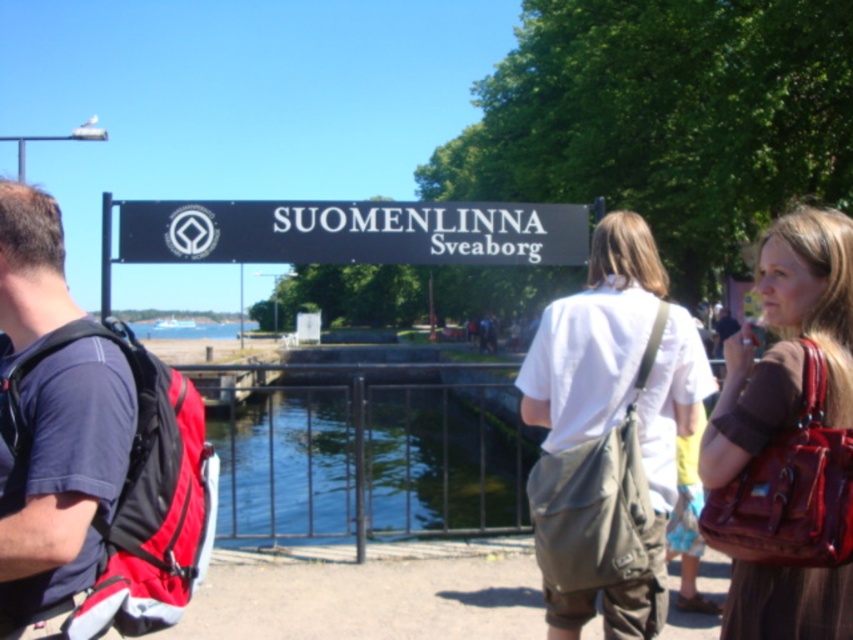
Between point (730, 468) and point (225, 220), which one is positioned behind?

Positioned behind is point (225, 220).

From the picture: Who is positioned more to the right, brown shiny handbag at center right or black plastic sign at center?

brown shiny handbag at center right

Which is behind, point (782, 582) or point (279, 236)?

Point (279, 236)

Image resolution: width=853 pixels, height=640 pixels. In order to click on brown shiny handbag at center right in this screenshot , I will do `click(787, 440)`.

What do you see at coordinates (367, 449) in the screenshot? I see `clear glass water at center` at bounding box center [367, 449].

Does clear glass water at center appear under white cotton shirt at center?

Indeed, clear glass water at center is positioned under white cotton shirt at center.

Describe the element at coordinates (367, 449) in the screenshot. The width and height of the screenshot is (853, 640). I see `clear glass water at center` at that location.

At what (x,y) coordinates should I click in order to perform the action: click on clear glass water at center. Please return your answer as a coordinate pair (x, y). This screenshot has width=853, height=640. Looking at the image, I should click on (367, 449).

Who is more forward, (238, 387) or (115, 422)?

Point (115, 422) is more forward.

Who is shorter, clear glass water at center or dark blue fabric shirt at left?

With less height is dark blue fabric shirt at left.

Who is more distant from viewer, [212,436] or [103,365]?

The point [212,436] is more distant.

At what (x,y) coordinates should I click in order to perform the action: click on clear glass water at center. Please return your answer as a coordinate pair (x, y). The image size is (853, 640). Looking at the image, I should click on (367, 449).